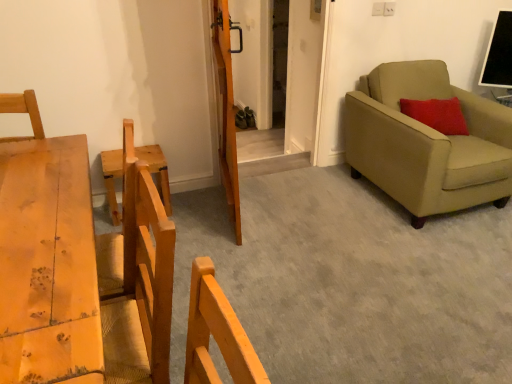
Locate an element on the screen. vacant area that lies to the right of wooden door at center is located at coordinates (294, 206).